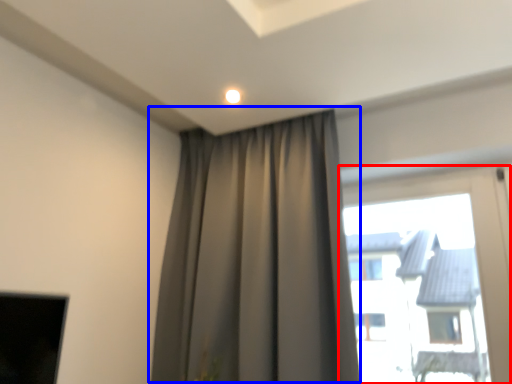
Question: Which of the following is the closest to the observer, window (highlighted by a red box) or curtain (highlighted by a blue box)?

Choices:
 (A) window
 (B) curtain

Answer: (B)